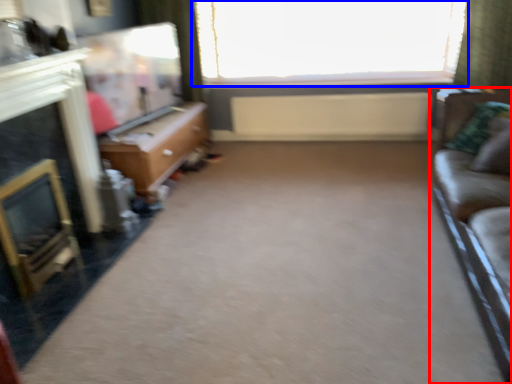
Question: Which point is closer to the camera, studio couch (highlighted by a red box) or window (highlighted by a blue box)?

Choices:
 (A) studio couch
 (B) window

Answer: (A)